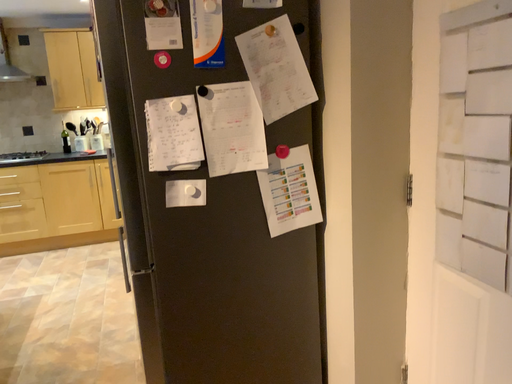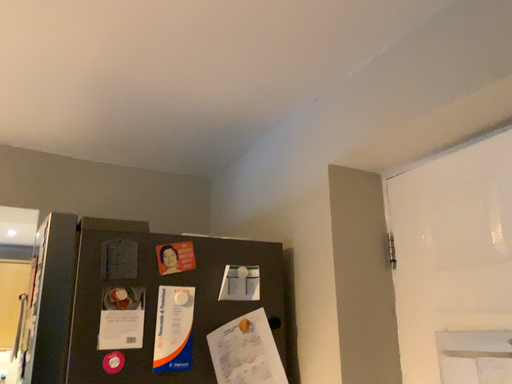
Question: Which way did the camera rotate in the video?

Choices:
 (A) rotated downward
 (B) rotated upward

Answer: (B)